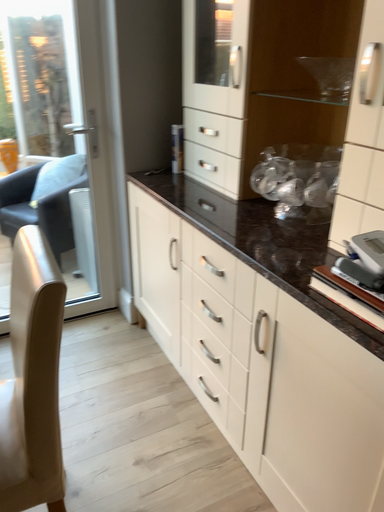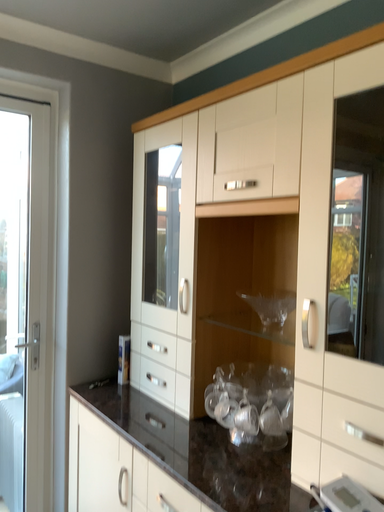
Question: How did the camera likely rotate when shooting the video?

Choices:
 (A) rotated upward
 (B) rotated downward

Answer: (A)